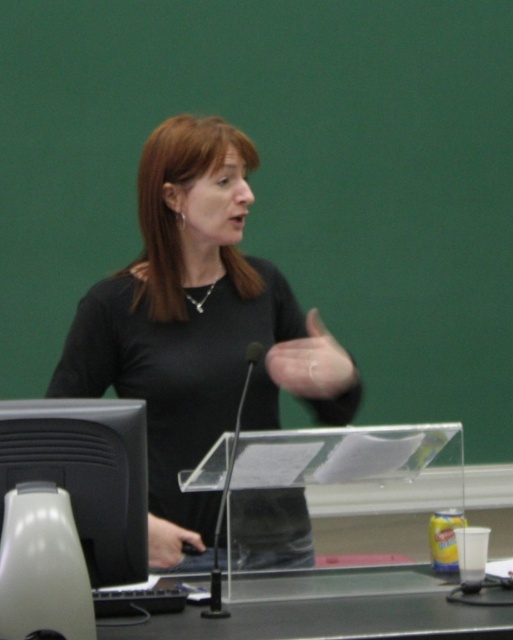
Does black matte shirt at center appear on the right side of green plastic table at lower center?

Incorrect, black matte shirt at center is not on the right side of green plastic table at lower center.

Is black matte shirt at center positioned behind green plastic table at lower center?

Yes, black matte shirt at center is further from the viewer.

Is point (180, 160) less distant than point (364, 580)?

No, (180, 160) is behind (364, 580).

Image resolution: width=513 pixels, height=640 pixels. In order to click on black matte shirt at center in this screenshot , I will do `click(199, 324)`.

Does green plastic table at lower center lie in front of black glossy monitor at lower left?

Yes, it is.

Who is more distant from viewer, (306, 611) or (14, 404)?

The point (306, 611) is more distant.

Identify the location of green plastic table at lower center. The width and height of the screenshot is (513, 640). (332, 609).

Does black matte shirt at center have a smaller size compared to black glossy monitor at lower left?

Actually, black matte shirt at center might be larger than black glossy monitor at lower left.

Is black matte shirt at center closer to camera compared to black glossy monitor at lower left?

No, black matte shirt at center is behind black glossy monitor at lower left.

At what (x,y) coordinates should I click in order to perform the action: click on black matte shirt at center. Please return your answer as a coordinate pair (x, y). The width and height of the screenshot is (513, 640). Looking at the image, I should click on (199, 324).